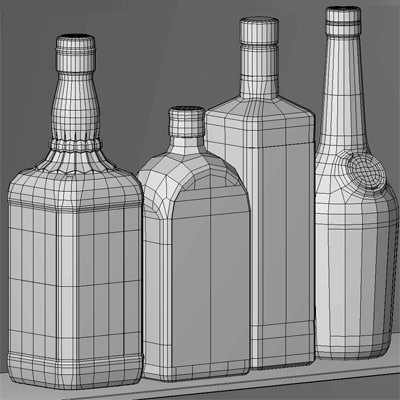
At what (x,y) coordinates should I click in order to perform the action: click on light gray countertop bordered with black lines. Please return your answer as a coordinate pair (x, y). Looking at the image, I should click on (209, 382), (247, 388).